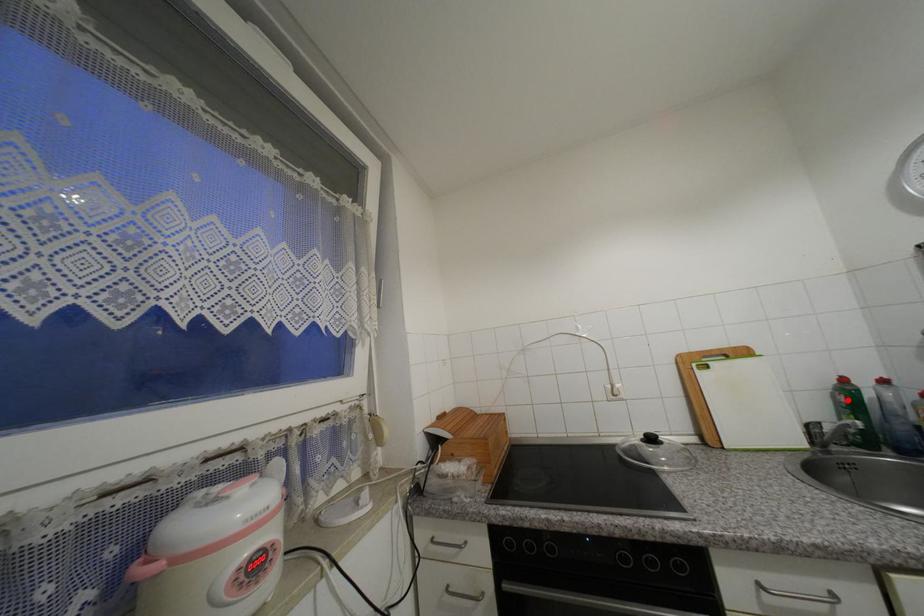
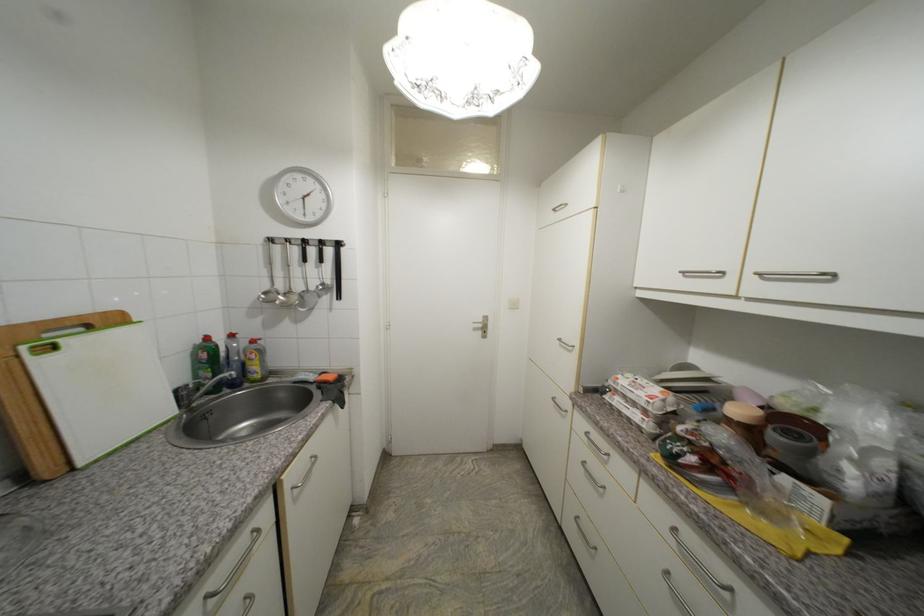
In the second image, find the point that corresponds to the highlighted location in the first image.

(210, 357)